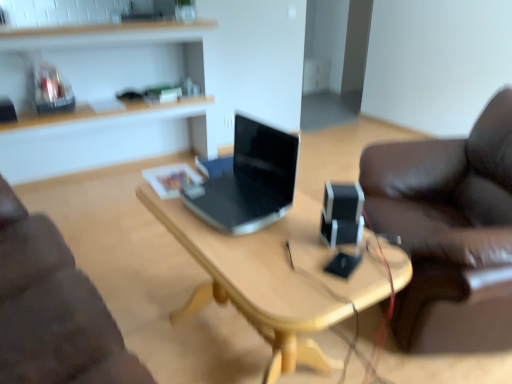
Question: Would you say wooden desk at center is inside or outside black plastic speaker at center?

Choices:
 (A) inside
 (B) outside

Answer: (B)

Question: From a real-world perspective, is wooden desk at center above or below black plastic speaker at center?

Choices:
 (A) above
 (B) below

Answer: (B)

Question: Which object is positioned farthest from the sleek black laptop at center?

Choices:
 (A) wooden at upper left
 (B) wooden desk at center
 (C) black plastic speaker at center

Answer: (A)

Question: Considering the real-world distances, which object is farthest from the sleek black laptop at center?

Choices:
 (A) wooden desk at center
 (B) black plastic speaker at center
 (C) wooden at upper left

Answer: (C)